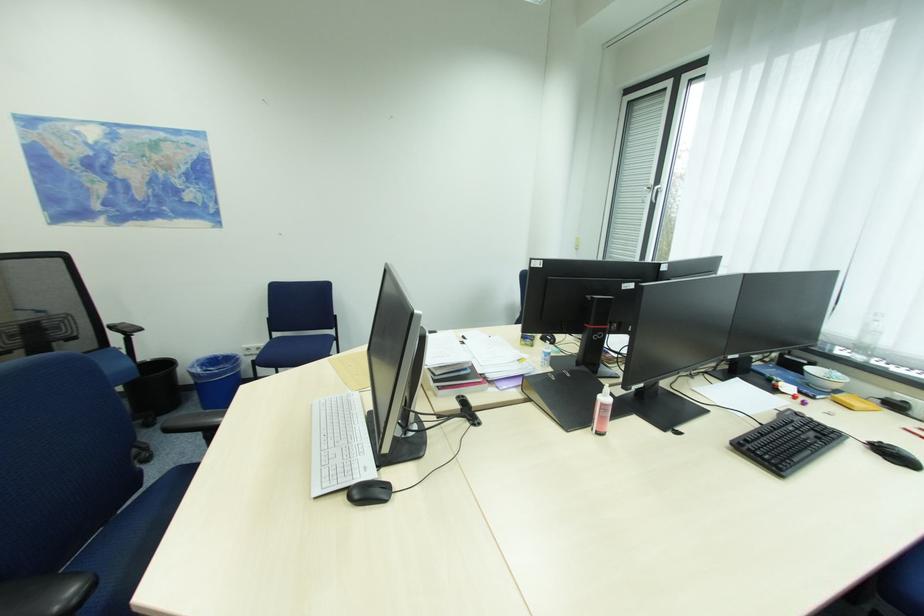
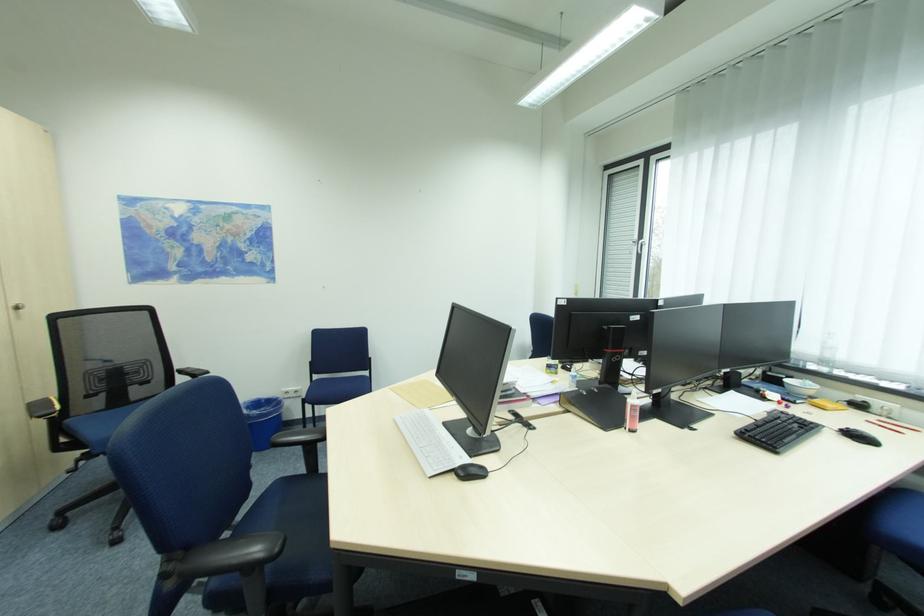
What movement of the cameraman would produce the second image?

The cameraman walked toward left, backward.